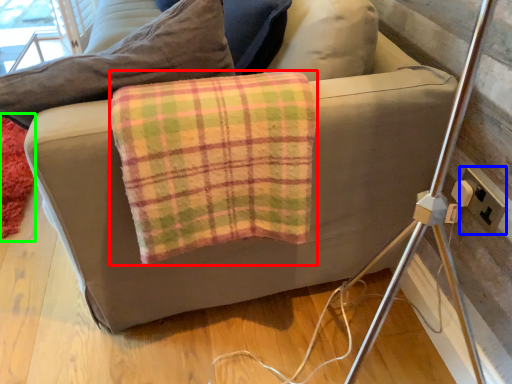
Question: Estimate the real-world distances between objects in this image. Which object is farther from material (highlighted by a red box), electric outlet (highlighted by a blue box) or mat (highlighted by a green box)?

Choices:
 (A) electric outlet
 (B) mat

Answer: (B)